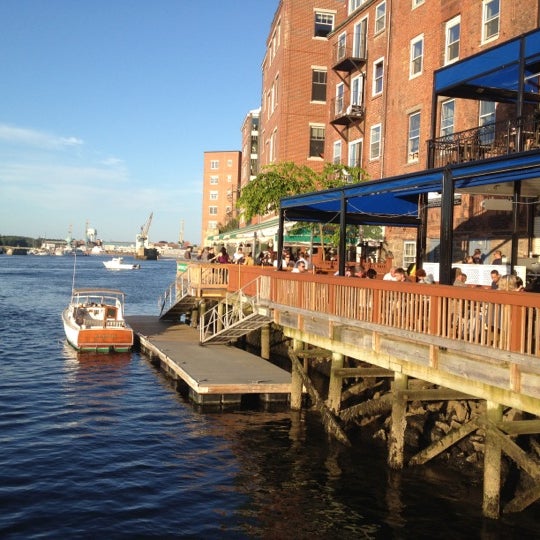
This screenshot has width=540, height=540. What are the coordinates of `blue shade` in the screenshot? It's located at coord(381,205).